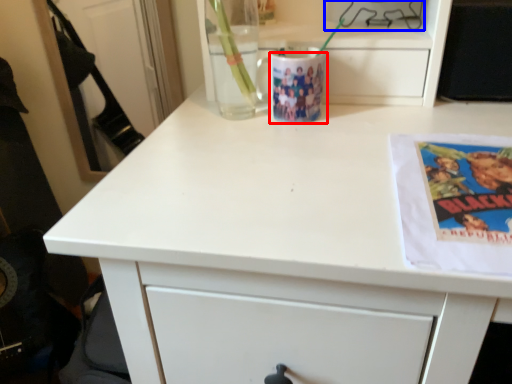
Question: Among these objects, which one is farthest to the camera, mug (highlighted by a red box) or appliance (highlighted by a blue box)?

Choices:
 (A) mug
 (B) appliance

Answer: (B)